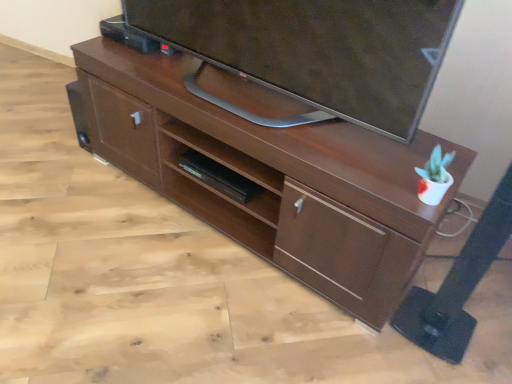
Question: Is brown wood desk at center taller than black matte shelf at center?

Choices:
 (A) yes
 (B) no

Answer: (A)

Question: From a real-world perspective, is brown wood desk at center over black matte shelf at center?

Choices:
 (A) no
 (B) yes

Answer: (B)

Question: Considering the relative sizes of brown wood desk at center and black matte shelf at center in the image provided, is brown wood desk at center shorter than black matte shelf at center?

Choices:
 (A) no
 (B) yes

Answer: (A)

Question: Is brown wood desk at center closer to the viewer compared to black matte shelf at center?

Choices:
 (A) no
 (B) yes

Answer: (B)

Question: Is brown wood desk at center thinner than black matte shelf at center?

Choices:
 (A) no
 (B) yes

Answer: (A)

Question: Could you tell me if brown wood desk at center is facing black matte shelf at center?

Choices:
 (A) no
 (B) yes

Answer: (B)

Question: Does black matte shelf at center come in front of matte black tv at upper center?

Choices:
 (A) no
 (B) yes

Answer: (A)

Question: Considering the relative sizes of black matte shelf at center and matte black tv at upper center in the image provided, is black matte shelf at center smaller than matte black tv at upper center?

Choices:
 (A) no
 (B) yes

Answer: (B)

Question: Does black matte shelf at center turn towards matte black tv at upper center?

Choices:
 (A) no
 (B) yes

Answer: (A)

Question: From a real-world perspective, does black matte shelf at center sit lower than matte black tv at upper center?

Choices:
 (A) yes
 (B) no

Answer: (A)

Question: Is black matte shelf at center wider than matte black tv at upper center?

Choices:
 (A) yes
 (B) no

Answer: (B)

Question: Can you confirm if black matte shelf at center is shorter than matte black tv at upper center?

Choices:
 (A) yes
 (B) no

Answer: (A)

Question: From the image's perspective, is brown wood desk at center beneath matte black tv at upper center?

Choices:
 (A) yes
 (B) no

Answer: (A)